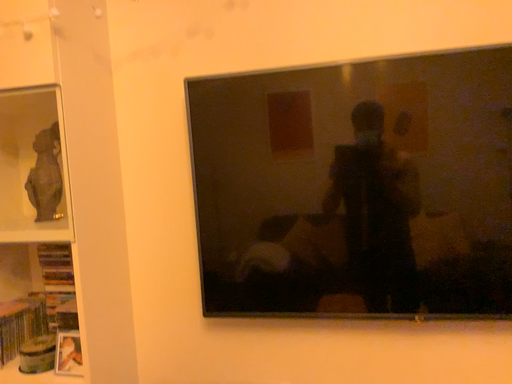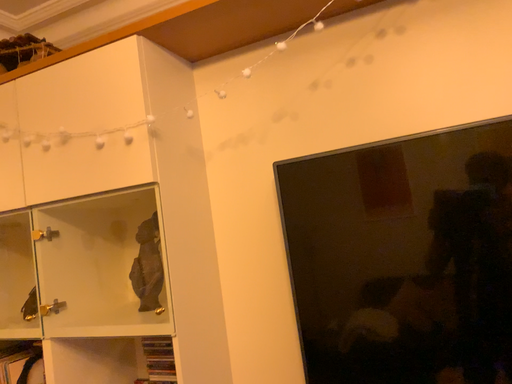
Question: Which way did the camera rotate in the video?

Choices:
 (A) rotated left
 (B) rotated right

Answer: (A)